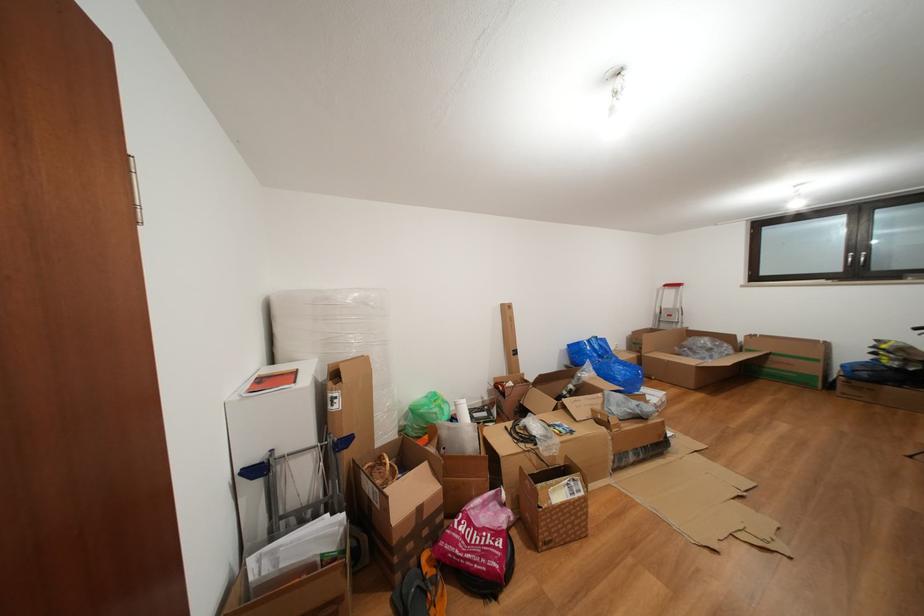
What do you see at coordinates (381, 471) in the screenshot? Image resolution: width=924 pixels, height=616 pixels. I see `the wicker basket handle` at bounding box center [381, 471].